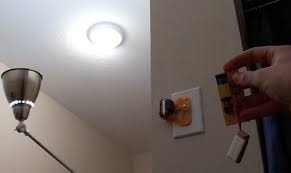
Where is `plug in outlet`? This screenshot has height=173, width=291. plug in outlet is located at coordinates (182, 112).